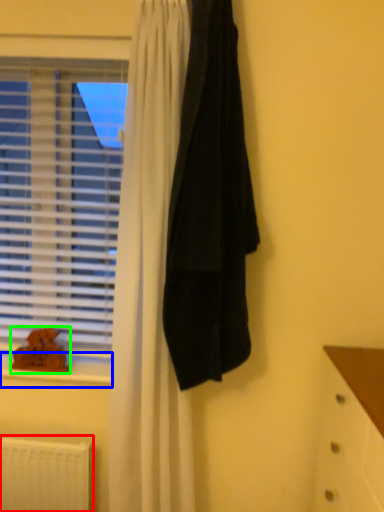
Question: Estimate the real-world distances between objects in this image. Which object is farther from radiator (highlighted by a red box), window sill (highlighted by a blue box) or animal (highlighted by a green box)?

Choices:
 (A) window sill
 (B) animal

Answer: (B)